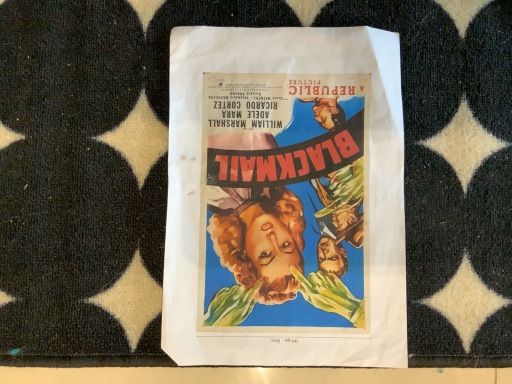
Question: Should I look upward or downward to see vibrant paper poster at center?

Choices:
 (A) up
 (B) down

Answer: (A)